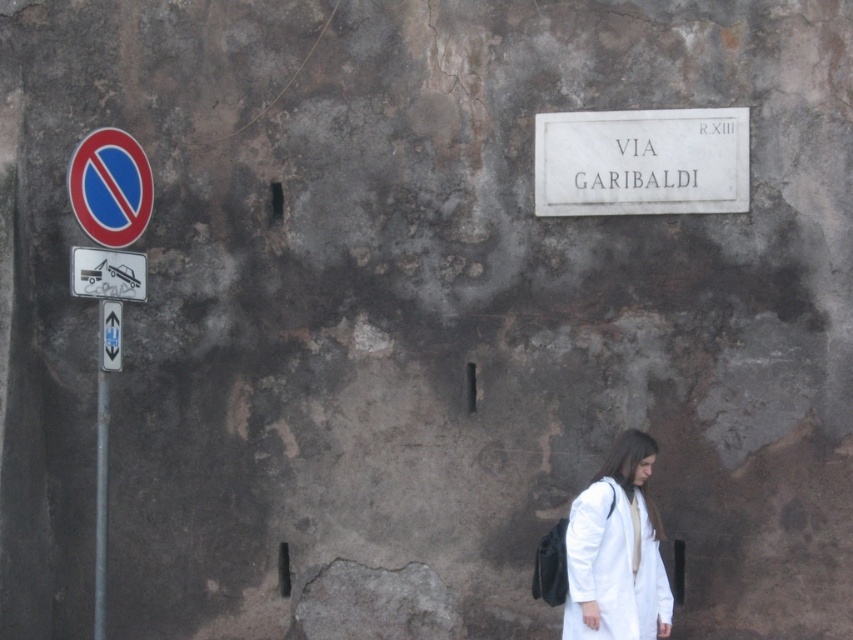
Question: Can you confirm if white marble sign at upper center is thinner than white plastic tow truck at left?

Choices:
 (A) no
 (B) yes

Answer: (A)

Question: Does white fabric coat at lower right appear on the left side of white plastic tow truck at left?

Choices:
 (A) no
 (B) yes

Answer: (A)

Question: Is white fabric coat at lower right further to the viewer compared to smooth plastic circle at left?

Choices:
 (A) no
 (B) yes

Answer: (B)

Question: Which of the following is the closest to the observer?

Choices:
 (A) white marble sign at upper center
 (B) white plastic tow truck at left
 (C) white fabric coat at lower right

Answer: (B)

Question: Which point is closer to the camera taking this photo?

Choices:
 (A) (90, 264)
 (B) (552, 177)
 (C) (132, 177)
 (D) (614, 488)

Answer: (A)

Question: Which point is closer to the camera?

Choices:
 (A) (77, 166)
 (B) (570, 145)
 (C) (618, 461)
 (D) (120, 282)

Answer: (A)